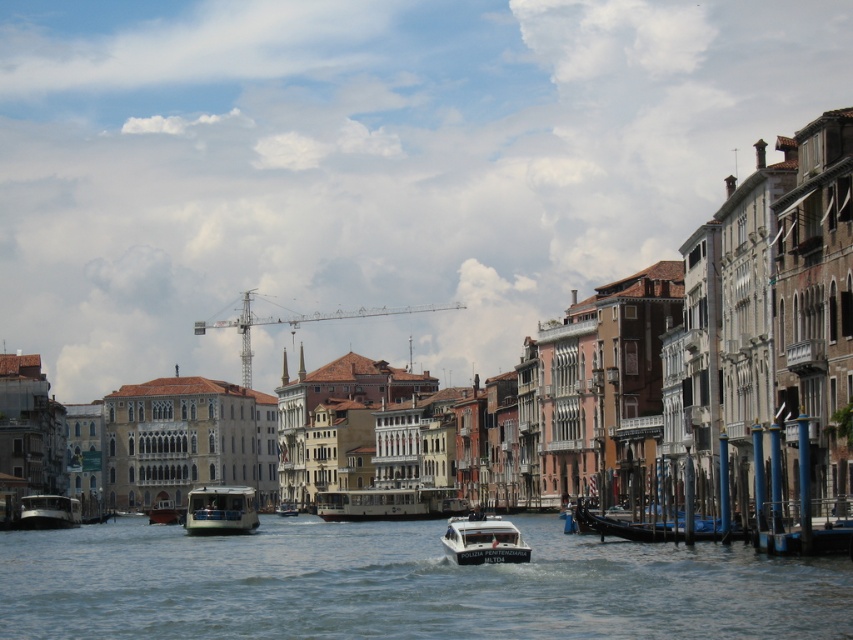
Question: Is clear water at center wider than green matte/glossy gondola at center?

Choices:
 (A) yes
 (B) no

Answer: (A)

Question: Which point is farther to the camera?

Choices:
 (A) (167, 518)
 (B) (488, 577)
 (C) (444, 499)
 (D) (486, 524)

Answer: (A)

Question: Estimate the real-world distances between objects in this image. Which object is farther from the white glossy police boat at center?

Choices:
 (A) clear water at center
 (B) white glossy boat at center
 (C) green matte/glossy gondola at center

Answer: (B)

Question: Can you confirm if green matte/glossy gondola at center is bigger than metallic silver boat at center?

Choices:
 (A) yes
 (B) no

Answer: (A)

Question: Which of the following is the closest to the observer?

Choices:
 (A) clear water at center
 (B) metallic silver boat at center
 (C) white matte/glossy boat at center

Answer: (A)

Question: Does green matte/glossy gondola at center have a larger size compared to white glossy boat at center?

Choices:
 (A) yes
 (B) no

Answer: (A)